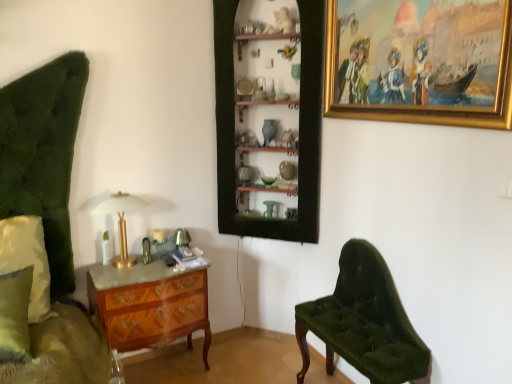
Question: Do you think gold-framed painting at upper right is within gold metallic table lamp at center, or outside of it?

Choices:
 (A) outside
 (B) inside

Answer: (A)

Question: Considering their positions, is gold-framed painting at upper right located in front of or behind gold metallic table lamp at center?

Choices:
 (A) front
 (B) behind

Answer: (A)

Question: Which of these objects is positioned closest to the green fabric pillow at left?

Choices:
 (A) velvet green bench at lower right
 (B) wooden shelves at center
 (C) gold-framed painting at upper right
 (D) wooden marquetry chest of drawers at lower left
 (E) gold metallic table lamp at center

Answer: (E)

Question: Estimate the real-world distances between objects in this image. Which object is farther from the gold metallic table lamp at center?

Choices:
 (A) velvet green bench at lower right
 (B) wooden shelves at center
 (C) green fabric pillow at left
 (D) wooden marquetry chest of drawers at lower left
 (E) gold-framed painting at upper right

Answer: (E)